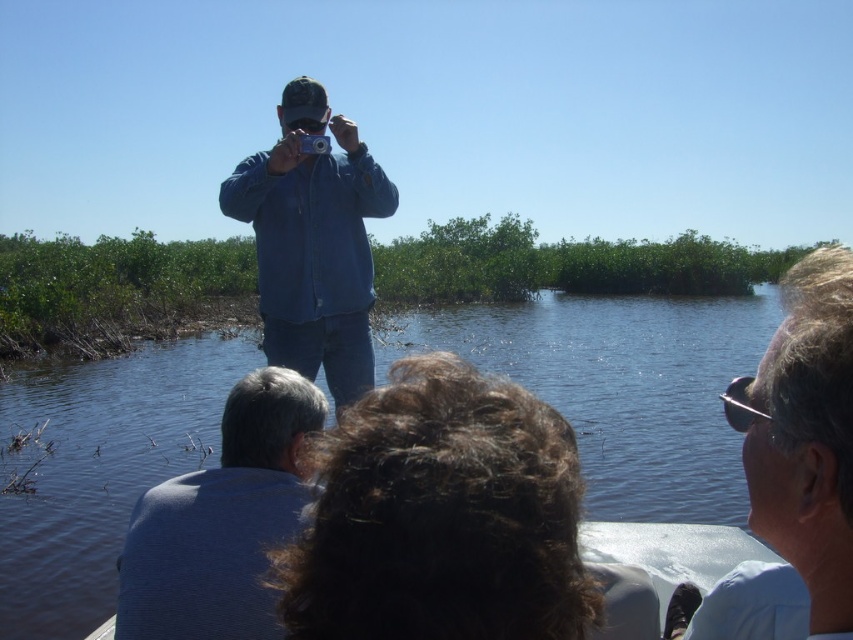
Question: Can you confirm if light blue shirt at upper right is bigger than blue striped shirt at lower left?

Choices:
 (A) yes
 (B) no

Answer: (A)

Question: Considering the relative positions of blue water at center and blue denim shirt at center in the image provided, where is blue water at center located with respect to blue denim shirt at center?

Choices:
 (A) above
 (B) below

Answer: (B)

Question: Which object appears farthest from the camera in this image?

Choices:
 (A) blue water at center
 (B) blue striped shirt at lower left
 (C) blue denim shirt at center
 (D) light blue shirt at upper right

Answer: (A)

Question: Which object is positioned farthest from the blue denim shirt at center?

Choices:
 (A) blue water at center
 (B) light blue shirt at upper right

Answer: (A)

Question: Which point is closer to the camera taking this photo?

Choices:
 (A) (228, 563)
 (B) (636, 433)
 (C) (309, 250)
 (D) (772, 592)

Answer: (D)

Question: Observing the image, what is the correct spatial positioning of blue water at center in reference to blue striped shirt at lower left?

Choices:
 (A) below
 (B) above

Answer: (B)